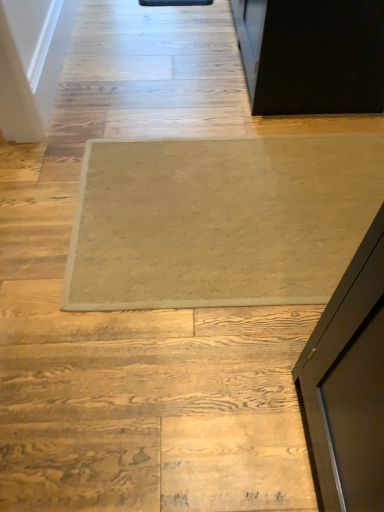
Question: From a real-world perspective, is beige carpet at center located higher than beige carpet at center?

Choices:
 (A) yes
 (B) no

Answer: (A)

Question: Is beige carpet at center placed right next to beige carpet at center?

Choices:
 (A) no
 (B) yes

Answer: (A)

Question: Can you confirm if beige carpet at center is bigger than beige carpet at center?

Choices:
 (A) yes
 (B) no

Answer: (A)

Question: Does beige carpet at center have a greater height compared to beige carpet at center?

Choices:
 (A) yes
 (B) no

Answer: (A)

Question: Is beige carpet at center outside beige carpet at center?

Choices:
 (A) yes
 (B) no

Answer: (A)

Question: Does beige carpet at center have a smaller size compared to beige carpet at center?

Choices:
 (A) no
 (B) yes

Answer: (A)

Question: Considering the relative positions of beige carpet at center and beige carpet at center in the image provided, is beige carpet at center to the left of beige carpet at center from the viewer's perspective?

Choices:
 (A) yes
 (B) no

Answer: (B)

Question: From the image's perspective, would you say beige carpet at center is positioned over beige carpet at center?

Choices:
 (A) no
 (B) yes

Answer: (A)

Question: Is beige carpet at center wider than beige carpet at center?

Choices:
 (A) no
 (B) yes

Answer: (A)

Question: Would you say beige carpet at center contains beige carpet at center?

Choices:
 (A) no
 (B) yes

Answer: (A)

Question: Can you confirm if beige carpet at center is smaller than beige carpet at center?

Choices:
 (A) yes
 (B) no

Answer: (A)

Question: Does beige carpet at center appear on the right side of beige carpet at center?

Choices:
 (A) yes
 (B) no

Answer: (A)

Question: From their relative heights in the image, would you say beige carpet at center is taller or shorter than beige carpet at center?

Choices:
 (A) short
 (B) tall

Answer: (B)